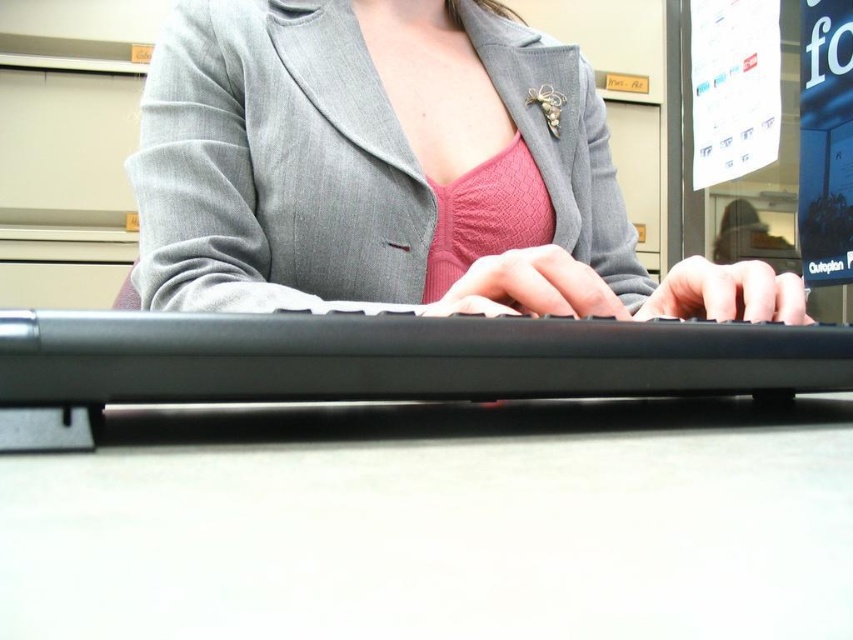
You are organizing a small meeting in the office. You have a gray woolen blazer at center and a white matte table at center. Which object takes up more space in the scene?

The gray woolen blazer at center takes up more space in the scene because the white matte table at center is smaller than the gray woolen blazer at center.

You are an office assistant who needs to determine if the gray woolen blazer at center can be placed on top of the black plastic keyboard at center without covering it completely. Based on their sizes, can the blazer cover the keyboard entirely?

The gray woolen blazer at center is taller than black plastic keyboard at center, so the blazer can cover the keyboard entirely.

You are organizing a desk and need to place the gray woolen blazer at center and the black plastic keyboard at center. Since the desk has limited space, which object should you place first to ensure both fit properly?

The gray woolen blazer at center has a larger size compared to the black plastic keyboard at center, so you should place the gray woolen blazer at center first to accommodate its larger size before placing the black plastic keyboard at center.